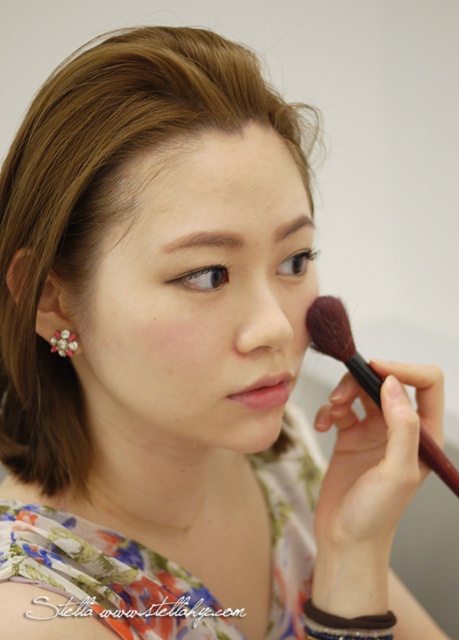
This screenshot has height=640, width=459. Find the location of `smooth skin at center`. smooth skin at center is located at coordinates (195, 296).

Is smooth skin at center to the left of matte pink lipstick at lower right from the viewer's perspective?

Correct, you'll find smooth skin at center to the left of matte pink lipstick at lower right.

Which is behind, point (107, 349) or point (263, 376)?

Positioned behind is point (107, 349).

Where is `smooth skin at center`? smooth skin at center is located at coordinates (195, 296).

Measure the distance between smooth skin at center and camera.

A distance of 15.42 inches exists between smooth skin at center and camera.

What do you see at coordinates (195, 296) in the screenshot? I see `smooth skin at center` at bounding box center [195, 296].

Between point (240, 236) and point (374, 387), which one is positioned behind?

Positioned behind is point (374, 387).

Where is `smooth skin at center`? This screenshot has height=640, width=459. smooth skin at center is located at coordinates (195, 296).

Does brown wooden brush at right have a lesser width compared to matte pink lipstick at lower right?

No, brown wooden brush at right is not thinner than matte pink lipstick at lower right.

Is point (431, 458) behind point (242, 403)?

Yes, point (431, 458) is farther from viewer.

Find the location of `brown wooden brush at right`. brown wooden brush at right is located at coordinates (340, 342).